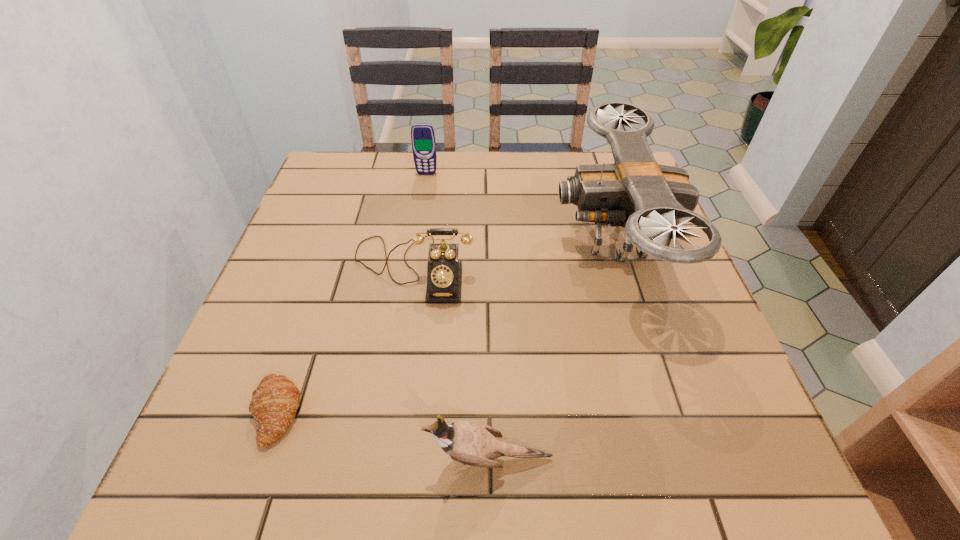
This screenshot has width=960, height=540. I want to click on object located at the left edge, so click(x=273, y=406).

Where is `object at the right edge`? object at the right edge is located at coordinates (650, 200).

What are the coordinates of `object present at the near left corner` in the screenshot? It's located at (273, 406).

I want to click on object that is positioned at the far right corner, so click(x=650, y=200).

Identify the location of blank space at the far edge. (434, 188).

The height and width of the screenshot is (540, 960). I want to click on vacant space at the near edge of the desktop, so click(406, 485).

Where is `free space at the left edge of the desktop`? free space at the left edge of the desktop is located at coordinates (274, 274).

Identify the location of vacant area at the right edge of the desktop. (687, 273).

You are a GUI agent. You are given a task and a screenshot of the screen. Output one action in this format:
    pyautogui.click(x=<x>, y=<y>)
    Task: Click on the blank area at the far left corner
    The image size is (960, 540).
    Given the screenshot: What is the action you would take?
    pyautogui.click(x=345, y=157)

The height and width of the screenshot is (540, 960). What are the coordinates of `unoccupied area between the crescent roll and the telephone` in the screenshot? It's located at (345, 340).